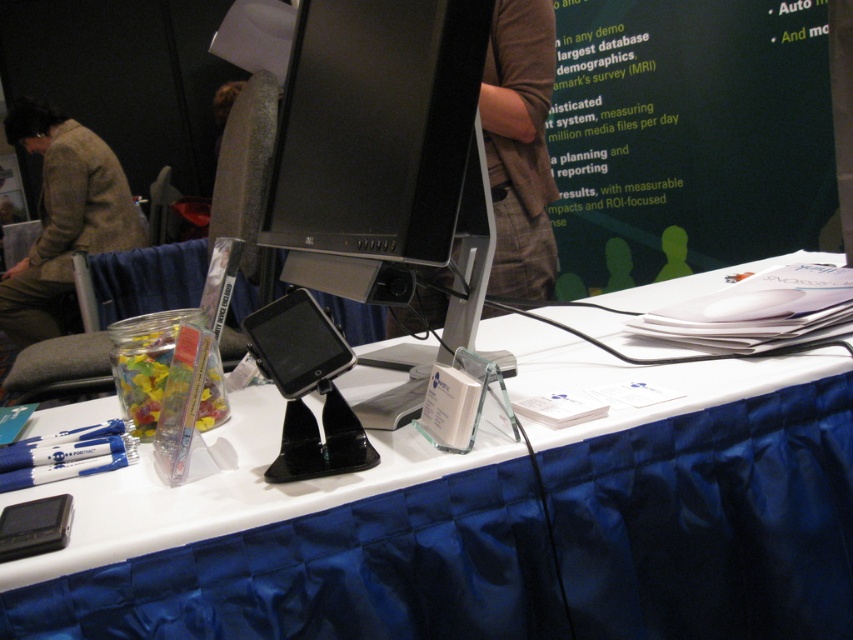
What do you see at coordinates (376, 128) in the screenshot? The image size is (853, 640). I see `black glossy monitor at center` at bounding box center [376, 128].

At what (x,y) coordinates should I click in order to perform the action: click on black glossy monitor at center. Please return your answer as a coordinate pair (x, y). Looking at the image, I should click on (376, 128).

What do you see at coordinates (376, 128) in the screenshot? Image resolution: width=853 pixels, height=640 pixels. I see `black glossy monitor at center` at bounding box center [376, 128].

You are a GUI agent. You are given a task and a screenshot of the screen. Output one action in this format:
    pyautogui.click(x=<x>, y=<y>)
    Task: Click on the black glossy monitor at center
    
    Given the screenshot: What is the action you would take?
    pyautogui.click(x=376, y=128)

Between white glossy table at center and black glossy monitor at center, which one appears on the right side from the viewer's perspective?

From the viewer's perspective, white glossy table at center appears more on the right side.

What do you see at coordinates (296, 548) in the screenshot?
I see `white glossy table at center` at bounding box center [296, 548].

The height and width of the screenshot is (640, 853). I want to click on white glossy table at center, so click(296, 548).

Identify the location of white glossy table at center. The height and width of the screenshot is (640, 853). (296, 548).

In the scene shown: Between white glossy table at center and brown textured jacket at upper left, which one is positioned lower?

Positioned lower is white glossy table at center.

Is white glossy table at center further to the viewer compared to brown textured jacket at upper left?

No, white glossy table at center is in front of brown textured jacket at upper left.

Who is more distant from viewer, [834,582] or [59,240]?

Positioned behind is point [59,240].

The height and width of the screenshot is (640, 853). I want to click on white glossy table at center, so click(x=296, y=548).